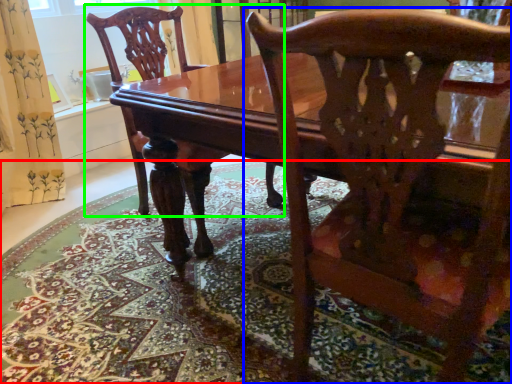
Question: Which is farther away from mat (highlighted by a red box)? chair (highlighted by a blue box) or chair (highlighted by a green box)?

Choices:
 (A) chair
 (B) chair

Answer: (A)